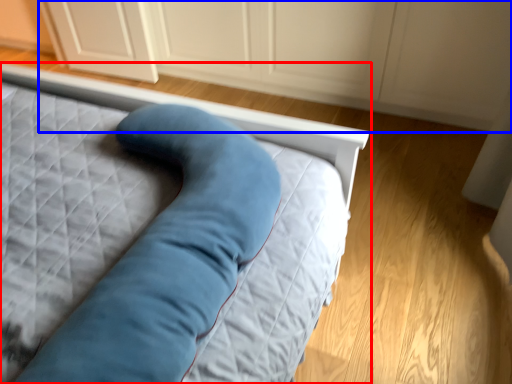
Question: Among these objects, which one is farthest to the camera, bed (highlighted by a red box) or dresser (highlighted by a blue box)?

Choices:
 (A) bed
 (B) dresser

Answer: (B)